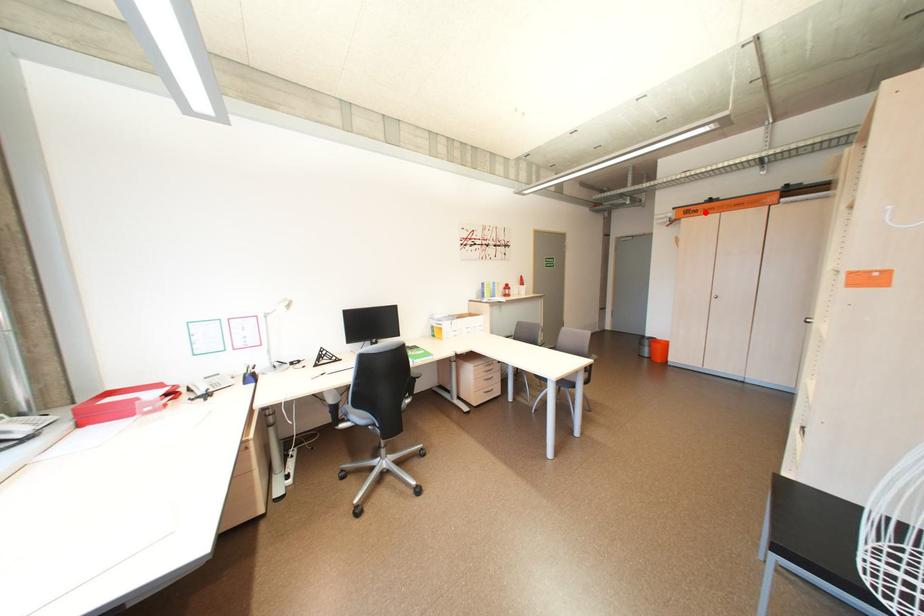
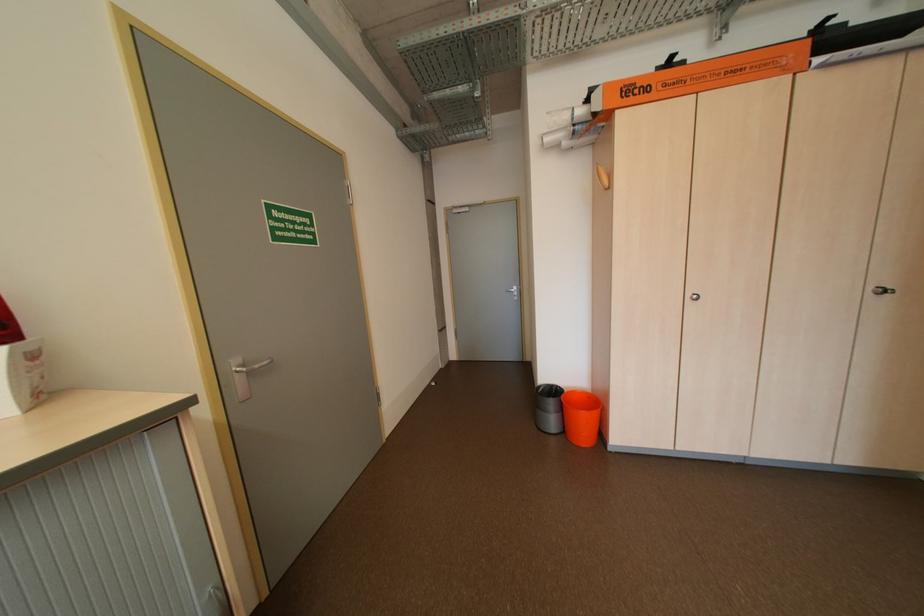
Locate, in the second image, the point that corresponds to the highlighted location in the first image.

(655, 90)